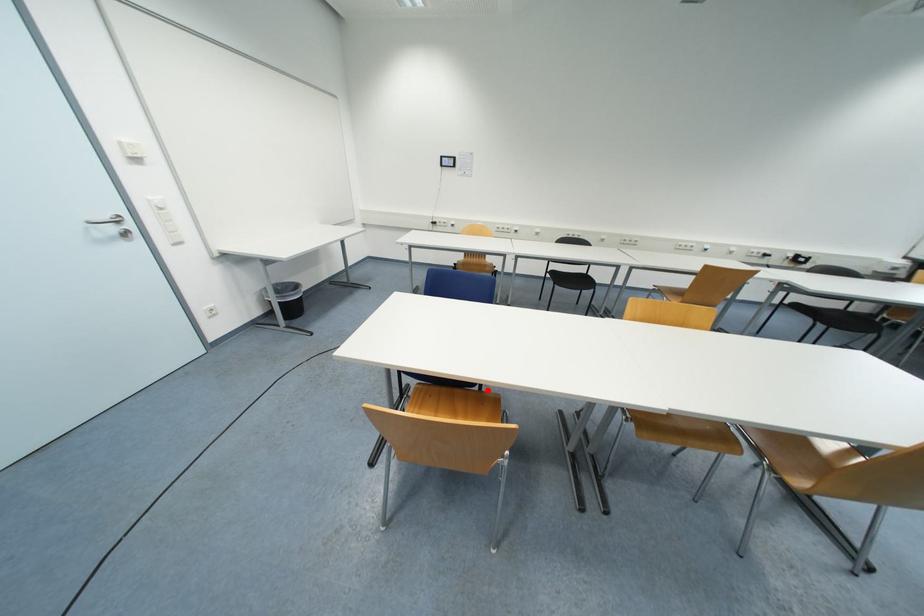
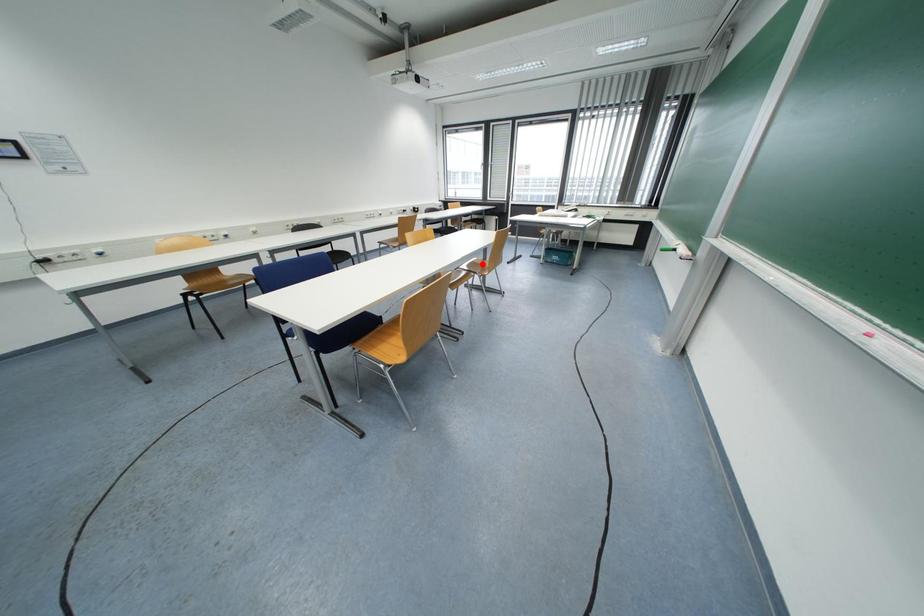
I am providing you with two images of the same scene from different viewpoints. A red point is marked on the first image and another point is marked on the second image. Do the highlighted points in image1 and image2 indicate the same real-world spot?

No